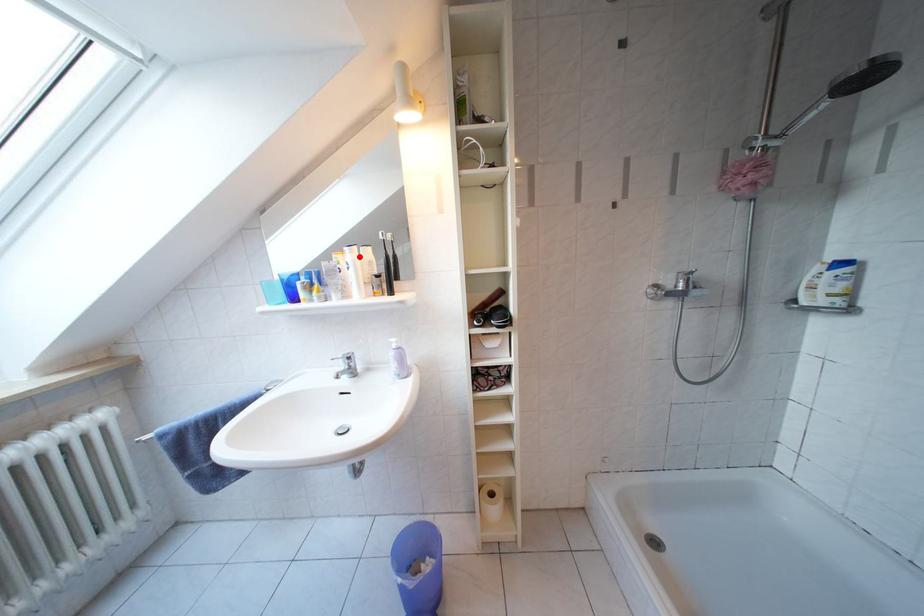
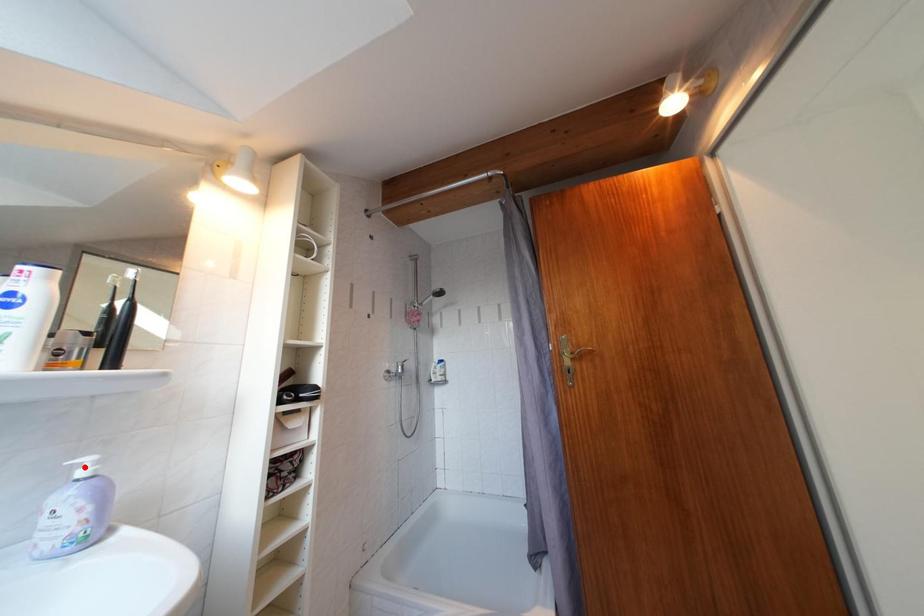
I am providing you with two images of the same scene from different viewpoints. A red point is marked on the first image and another point is marked on the second image. Are the points marked in image1 and image2 representing the same 3D position?

No